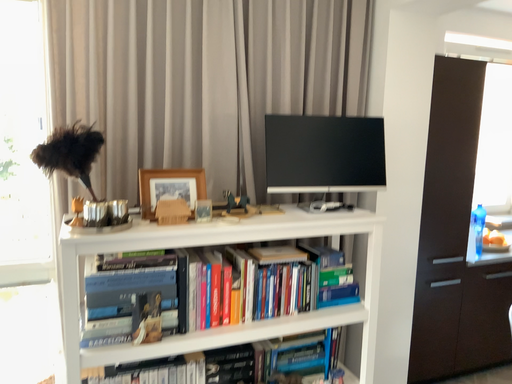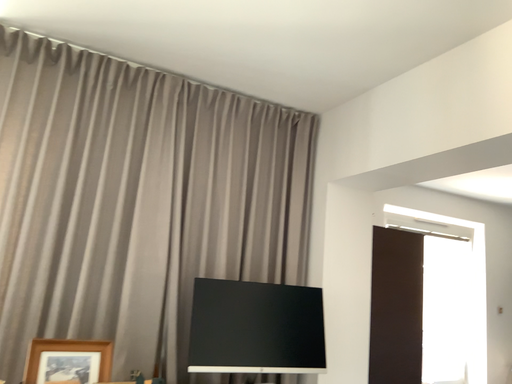
Question: How did the camera likely rotate when shooting the video?

Choices:
 (A) rotated left
 (B) rotated right

Answer: (B)